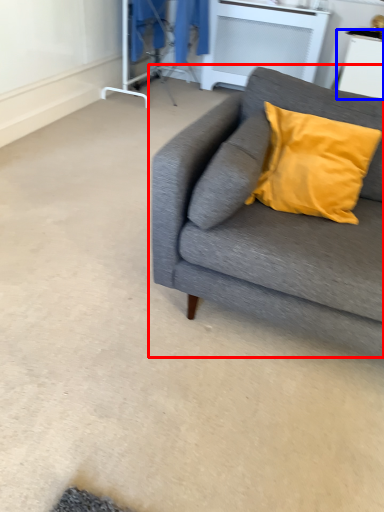
Question: Among these objects, which one is farthest to the camera, studio couch (highlighted by a red box) or table (highlighted by a blue box)?

Choices:
 (A) studio couch
 (B) table

Answer: (B)